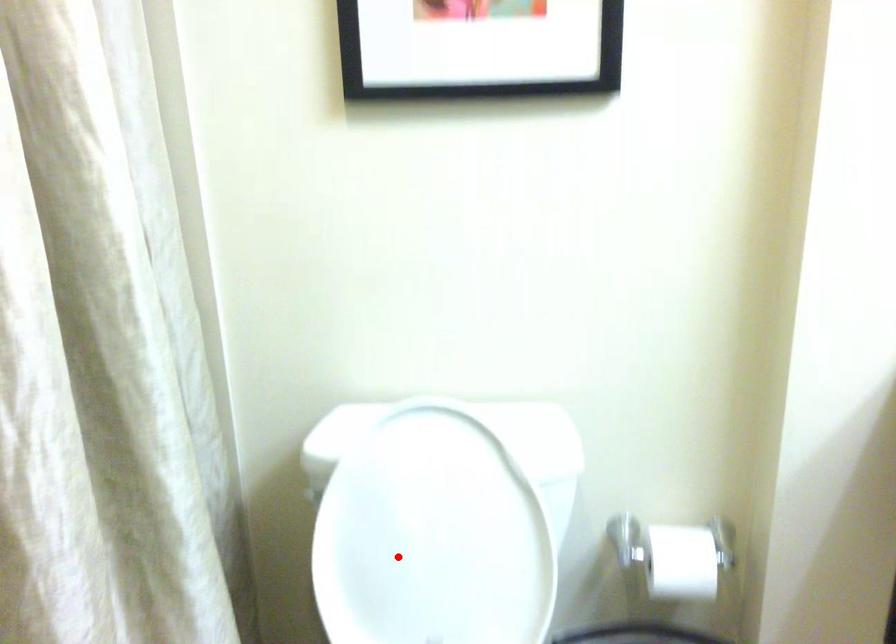
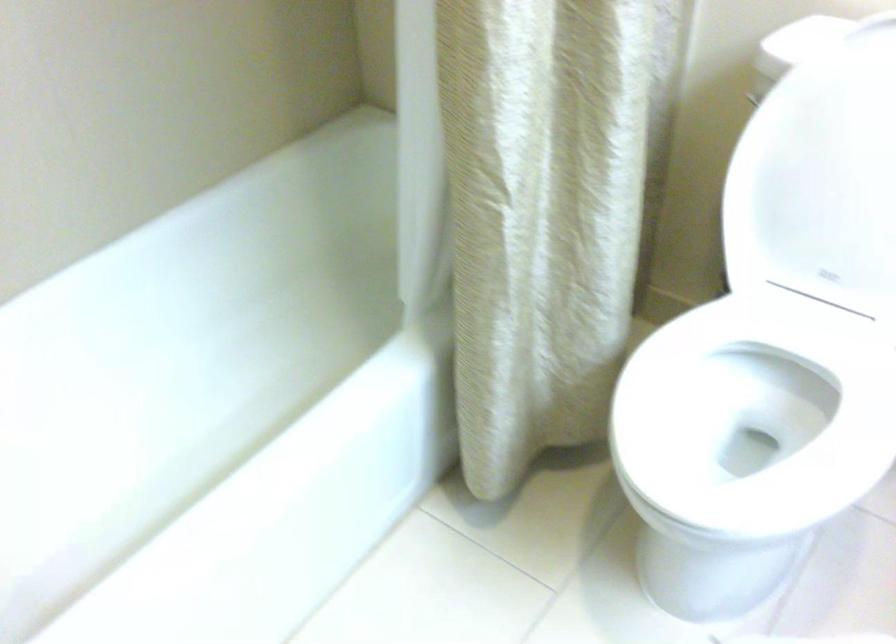
Where in the second image is the point corresponding to the highlighted location from the first image?

(821, 178)